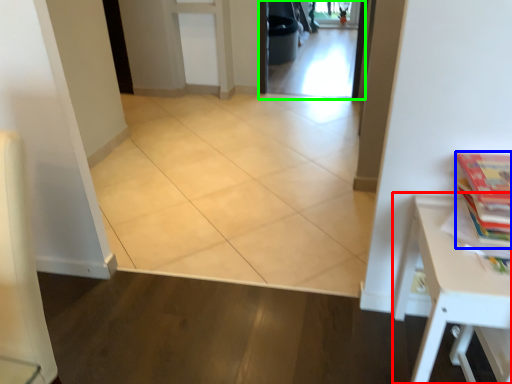
Question: Based on their relative distances, which object is nearer to table (highlighted by a red box)? Choose from book (highlighted by a blue box) and screen door (highlighted by a green box).

Choices:
 (A) book
 (B) screen door

Answer: (A)